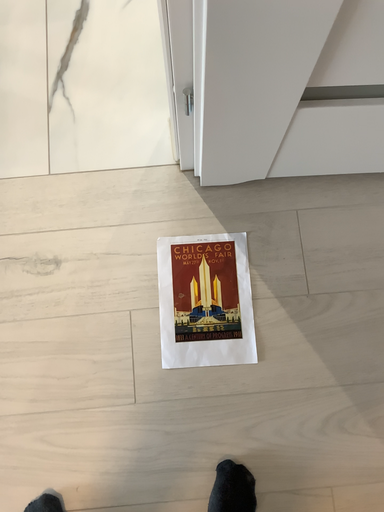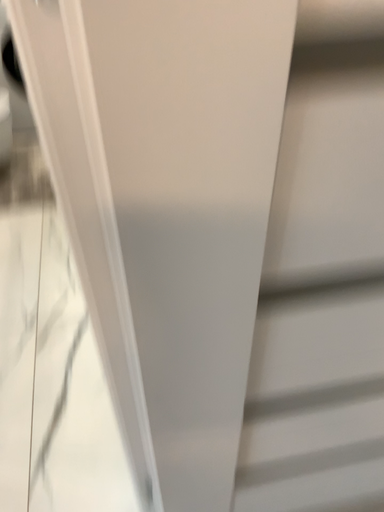
Question: How did the camera likely rotate when shooting the video?

Choices:
 (A) rotated upward
 (B) rotated downward

Answer: (A)